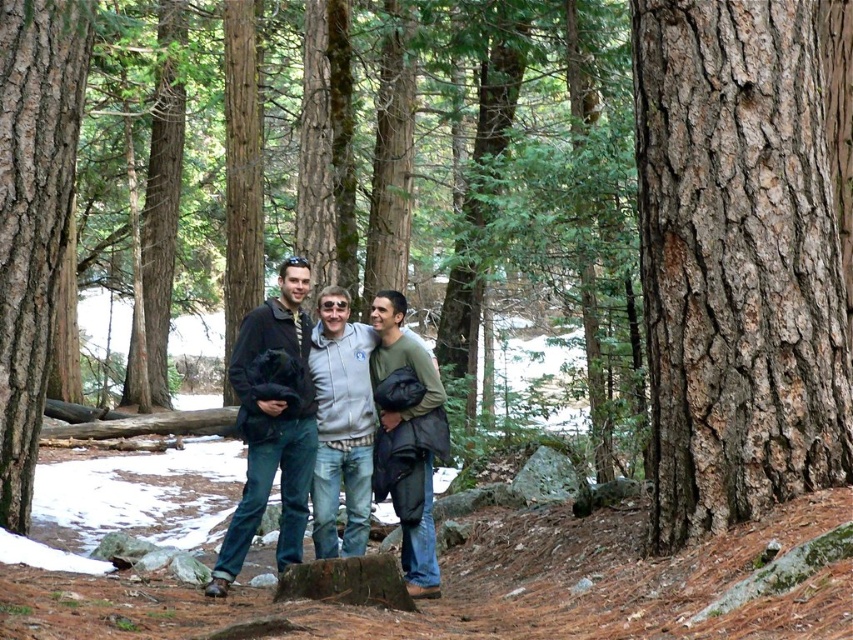
You are a hiker who wants to hang your gray fleece jacket at center on the smooth brown bark at center. Can you hang it there?

The smooth brown bark at center is located above the gray fleece jacket at center, so yes, you can hang the gray fleece jacket at center on the smooth brown bark at center since it is positioned above it.

You are a hiker trying to take a photo of the gray fleece jacket at center. You notice a smooth brown bark at center in the background. Will the bark be in focus if you focus on the jacket?

The smooth brown bark at center is closer to the viewer than the gray fleece jacket at center, so focusing on the jacket will likely leave the bark out of focus.

You are standing in the forest scene and want to walk from point A to point B. Point A is at coordinates point (53, 3) and point B is at coordinates point (424, 541). Since you can only move forward, will you be moving towards or away from the camera as you go from point A to point B?

Since point A is further to the camera than point B, moving from point A to point B means you are moving away from the camera.